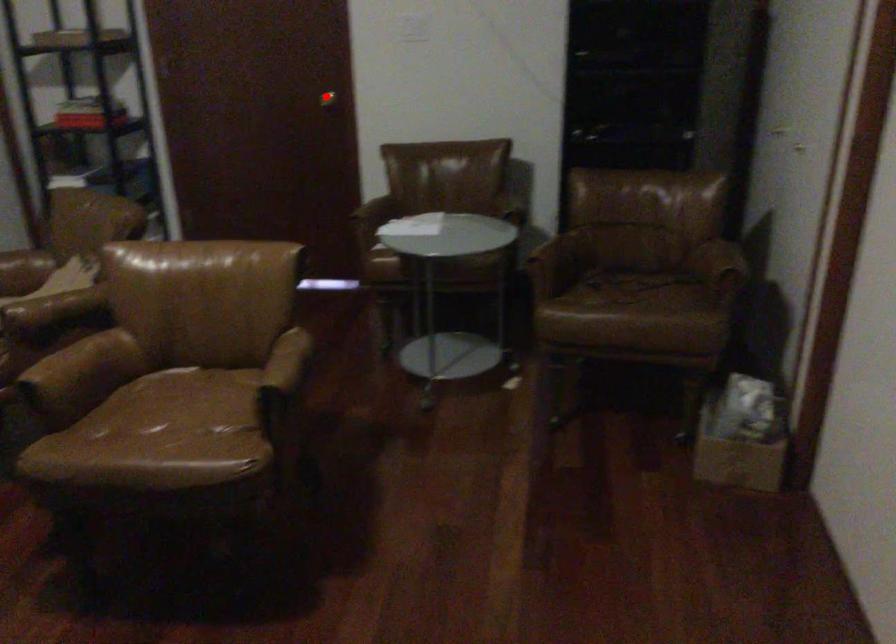
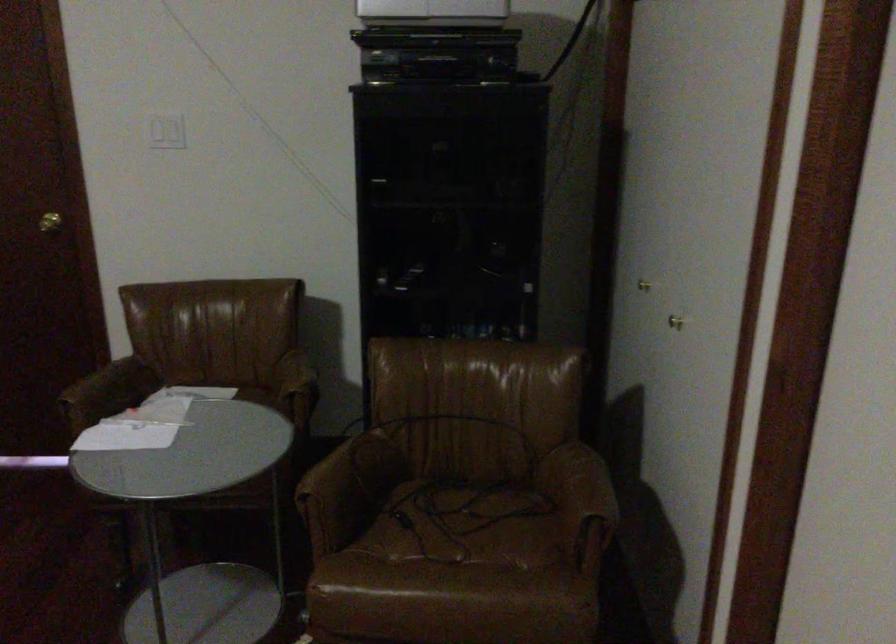
Question: I am providing you with two images of the same scene from different viewpoints. A red point is shown in image1. For the corresponding object point in image2, is it positioned nearer or farther from the camera?

Choices:
 (A) Nearer
 (B) Farther

Answer: (A)